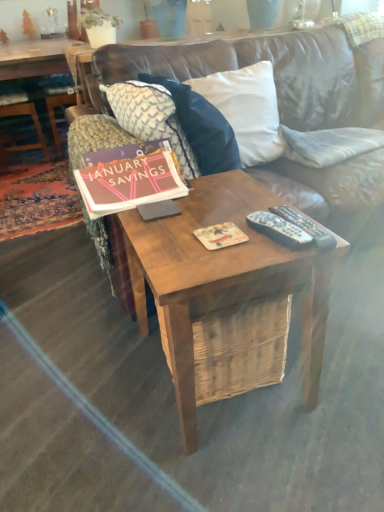
This screenshot has height=512, width=384. In order to click on free location to the left of matte cardboard magazine at center in this screenshot , I will do `click(167, 240)`.